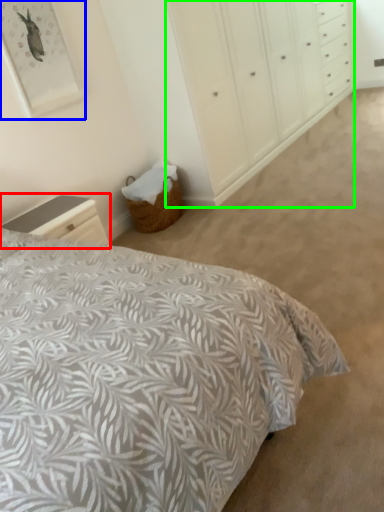
Question: Which is farther away from nightstand (highlighted by a red box)? picture frame (highlighted by a blue box) or dresser (highlighted by a green box)?

Choices:
 (A) picture frame
 (B) dresser

Answer: (B)